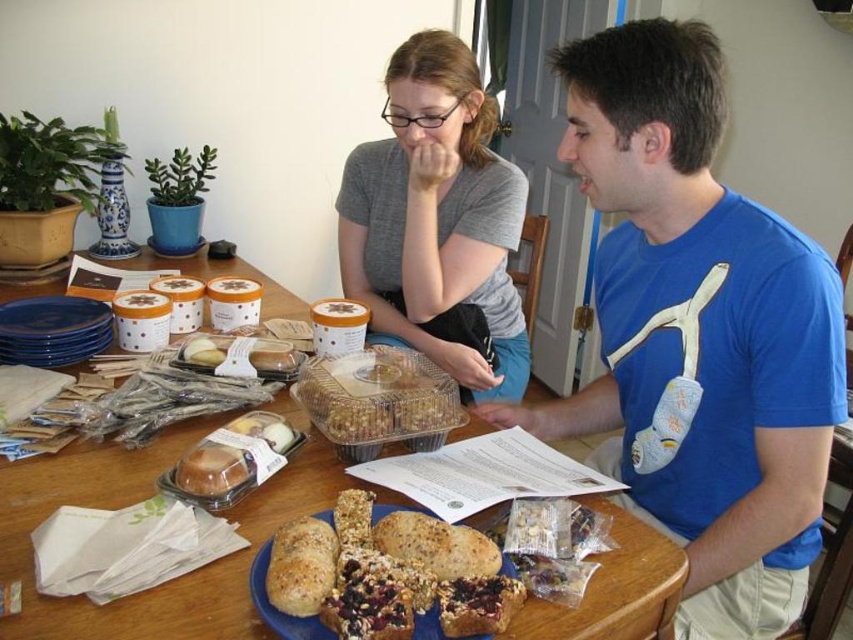
Which is more to the left, matte plastic container at center or brown textured bread at center?

matte plastic container at center is more to the left.

Describe the element at coordinates (235, 456) in the screenshot. The height and width of the screenshot is (640, 853). I see `matte plastic container at center` at that location.

I want to click on matte plastic container at center, so click(235, 456).

Locate an element on the screen. The height and width of the screenshot is (640, 853). brown crumbly bread at center is located at coordinates 300,566.

Is brown crumbly bread at center bigger than crusty granola bar at center?

Yes, brown crumbly bread at center is bigger than crusty granola bar at center.

Does point (285, 536) come farther from viewer compared to point (519, 598)?

Yes, point (285, 536) is behind point (519, 598).

The image size is (853, 640). Identify the location of brown crumbly bread at center. (300, 566).

Does gray matte shirt at upper center have a smaller size compared to translucent plastic container at center?

No.

The image size is (853, 640). Find the location of `gray matte shirt at upper center`. gray matte shirt at upper center is located at coordinates (437, 221).

Who is more forward, (434, 99) or (225, 454)?

Point (225, 454) is in front.

At what (x,y) coordinates should I click in order to perform the action: click on gray matte shirt at upper center. Please return your answer as a coordinate pair (x, y). The image size is (853, 640). Looking at the image, I should click on (437, 221).